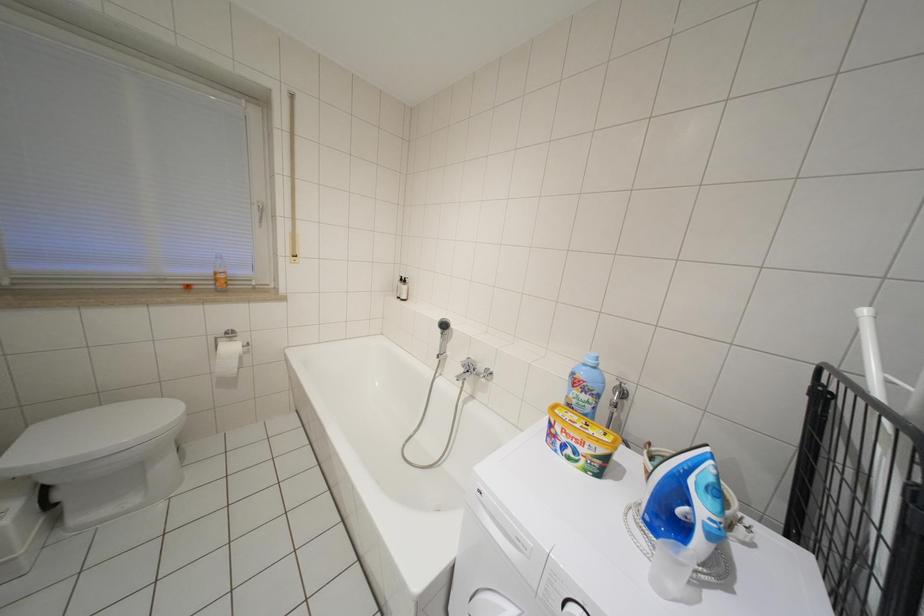
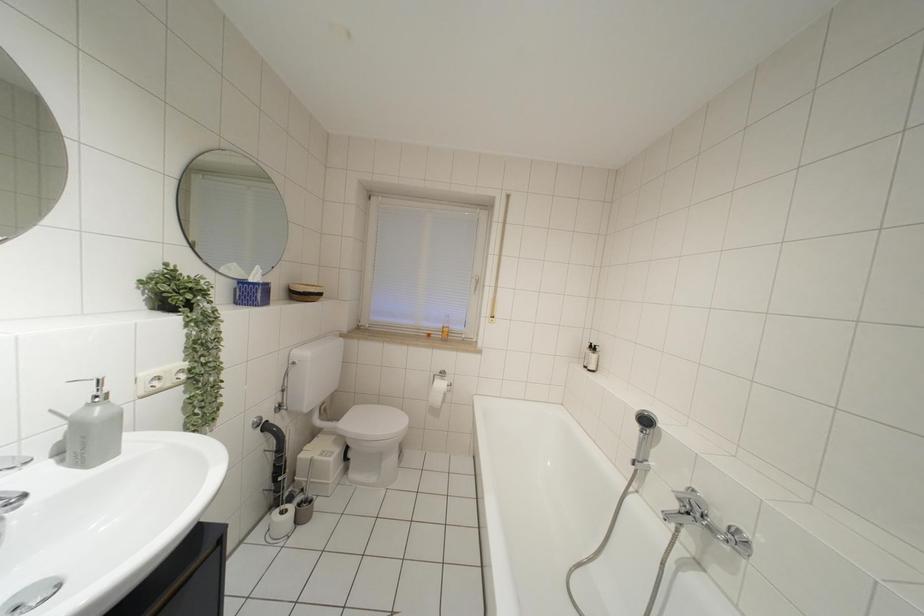
Question: How did the camera likely rotate?

Choices:
 (A) Left
 (B) Right
 (C) Up
 (D) Down

Answer: (A)